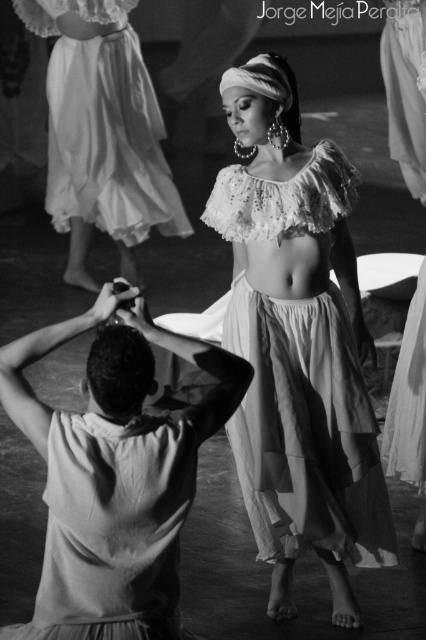
You are a costume designer observing the dance performance. You notice two skirts at the center of the image, the matte white fabric skirt at center and the light beige fabric skirt at center. Which one is thinner?

The matte white fabric skirt at center is thinner than the light beige fabric skirt at center.

You are a photographer observing the dancers in the scene. You notice two white skirts in the image. Which one is closer to you, the matte white fabric skirt at center or the white sheer skirt at upper center?

The matte white fabric skirt at center is closer to you because it is in front of the white sheer skirt at upper center.